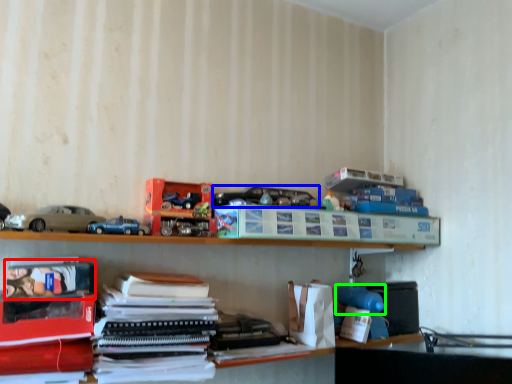
Question: Considering the real-world distances, which object is farthest from book (highlighted by a red box)? toy (highlighted by a blue box) or toy (highlighted by a green box)?

Choices:
 (A) toy
 (B) toy

Answer: (B)